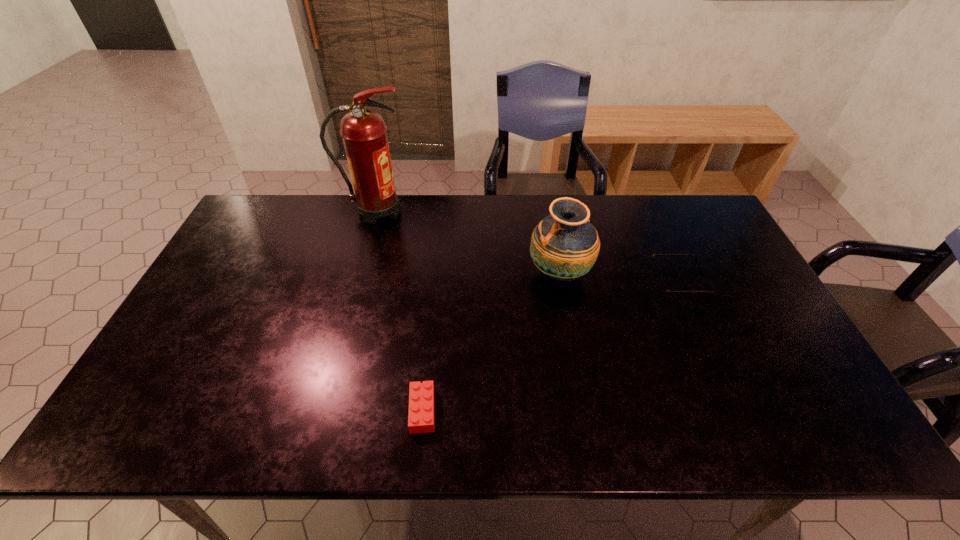
The image size is (960, 540). I want to click on fire extinguisher, so click(363, 131).

Find the location of a particular element. The width and height of the screenshot is (960, 540). the tallest object is located at coordinates [363, 131].

Locate an element on the screen. This screenshot has width=960, height=540. the second object from right to left is located at coordinates [x=564, y=246].

In order to click on pottery in this screenshot , I will do pyautogui.click(x=564, y=246).

You are a GUI agent. You are given a task and a screenshot of the screen. Output one action in this format:
    pyautogui.click(x=<x>, y=<y>)
    Task: Click on the spectacles
    The image size is (960, 540).
    Given the screenshot: What is the action you would take?
    pyautogui.click(x=663, y=291)

The image size is (960, 540). I want to click on the rightmost object, so click(663, 291).

Locate an element on the screen. This screenshot has width=960, height=540. the shortest object is located at coordinates (421, 417).

Where is `the nearest object`? The height and width of the screenshot is (540, 960). the nearest object is located at coordinates (421, 417).

Locate an element on the screen. vacant point located 0.330m on the front-facing side of the farthest object is located at coordinates (506, 211).

The height and width of the screenshot is (540, 960). I want to click on vacant region located on the right of the second object from right to left, so click(699, 273).